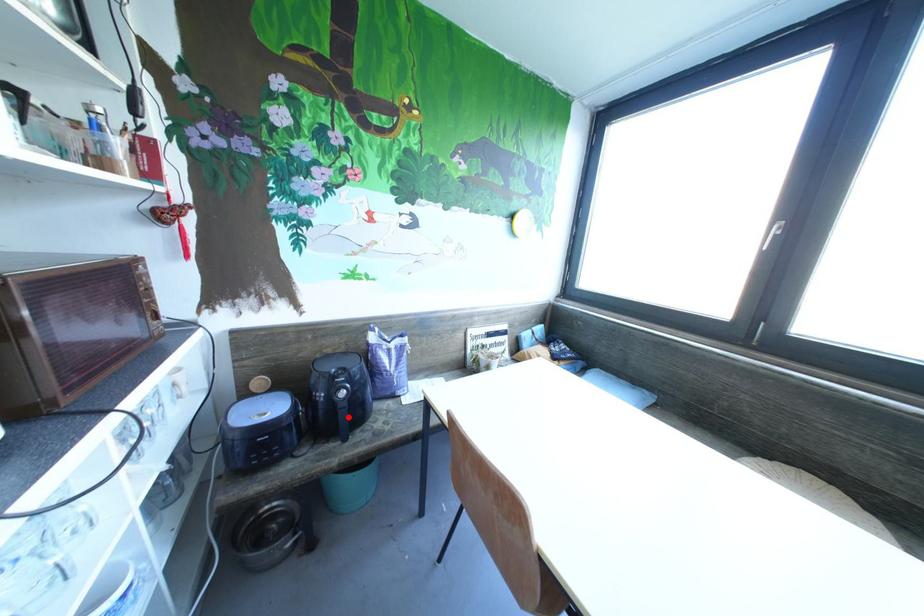
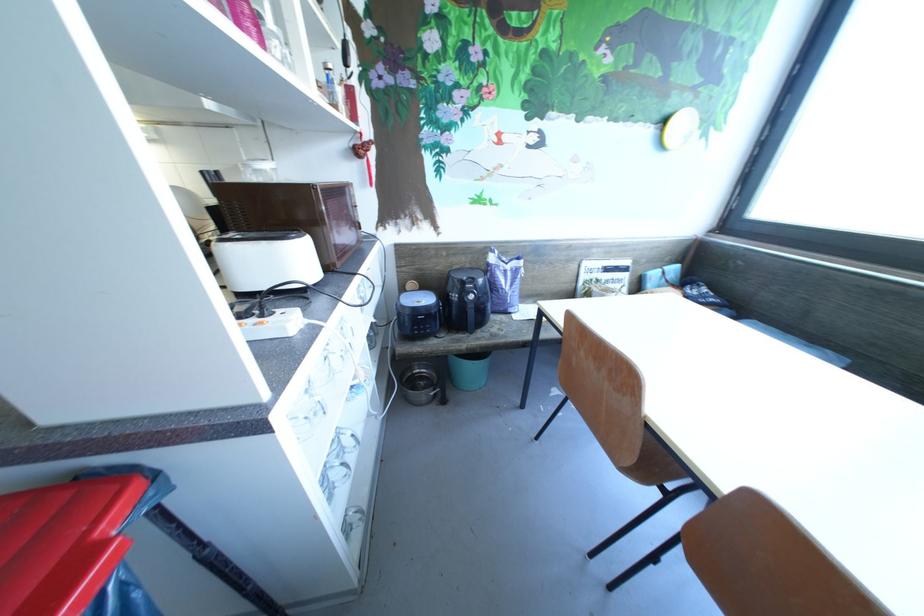
Find the pixel in the second image that matches the highlighted location in the first image.

(477, 315)